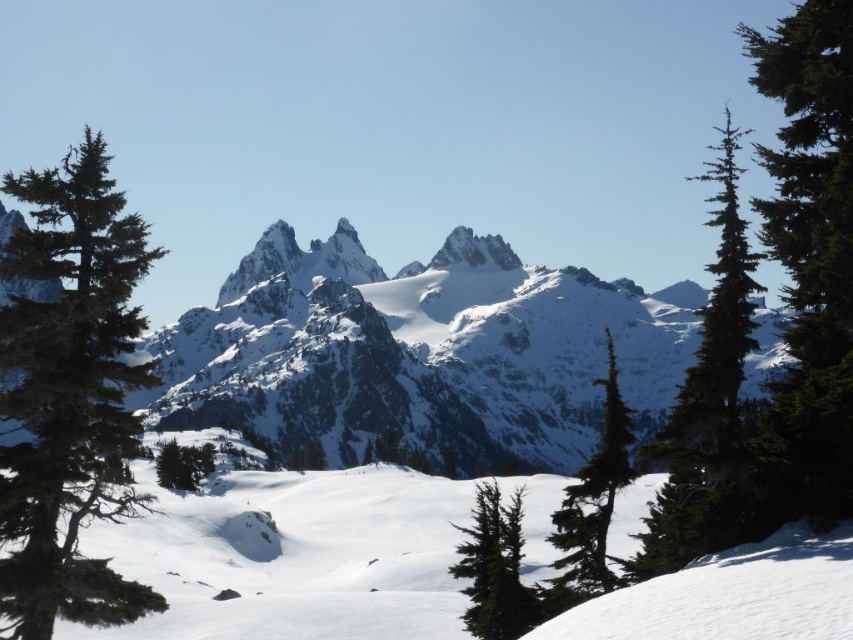
Question: Which point appears closest to the camera in this image?

Choices:
 (A) (720, 460)
 (B) (112, 282)

Answer: (B)

Question: Is green needle-like tree at left in front of green textured pine tree at right?

Choices:
 (A) yes
 (B) no

Answer: (A)

Question: Which object is the closest to the green matte tree at lower left?

Choices:
 (A) green matte tree at center
 (B) snowy granite mountain range at center
 (C) green needle-like tree at right

Answer: (A)

Question: Is green needle-like tree at left positioned behind green matte tree at center?

Choices:
 (A) yes
 (B) no

Answer: (B)

Question: Which of these objects is positioned closest to the green textured pine tree at right?

Choices:
 (A) green needle-like tree at left
 (B) green needle-like tree at right
 (C) snowy granite mountain range at center
 (D) green matte tree at lower left

Answer: (B)

Question: Is green needle-like tree at right to the left of green matte tree at center from the viewer's perspective?

Choices:
 (A) yes
 (B) no

Answer: (B)